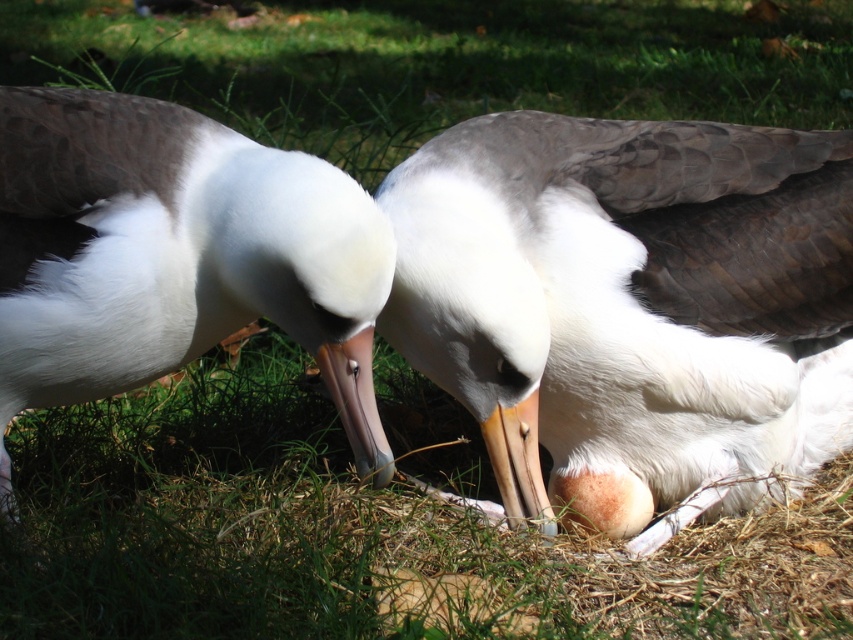
You are a wildlife photographer trying to capture a closeup of the egg. You notice the white fluffy feathers at center and the white matte mollymawk at center are both near the egg. Which object is wider so that it might block your view of the egg?

The white fluffy feathers at center is wider than the white matte mollymawk at center, so it might block your view of the egg.

You are a wildlife photographer observing two albatrosses at their nest. You notice the white fluffy feathers at center and the white matte mollymawk at center. Which of these two objects is positioned to the right of the other?

The white fluffy feathers at center are to the right of the white matte mollymawk at center.